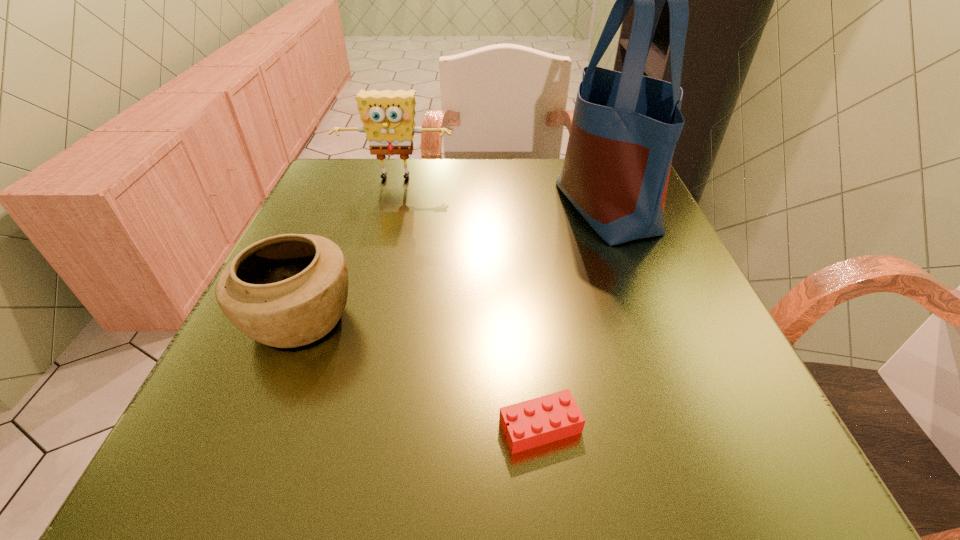
In order to click on vacant space at the near edge of the desktop in this screenshot , I will do `click(359, 470)`.

Image resolution: width=960 pixels, height=540 pixels. In the image, there is a desktop. Find the location of `vacant area at the left edge`. vacant area at the left edge is located at coordinates (351, 217).

What are the coordinates of `vacant region at the right edge of the desktop` in the screenshot? It's located at (675, 241).

In the image, there is a desktop. Identify the location of vacant space at the far left corner. coord(304,209).

You are a GUI agent. You are given a task and a screenshot of the screen. Output one action in this format:
    pyautogui.click(x=<x>, y=<y>)
    Task: Click on the free spot at the near left corner of the desktop
    The image size is (960, 540).
    Given the screenshot: What is the action you would take?
    pyautogui.click(x=230, y=456)

Where is `free space between the shortest object and the handbag`? Image resolution: width=960 pixels, height=540 pixels. free space between the shortest object and the handbag is located at coordinates (573, 317).

Where is `vacant space that's between the sponge and the third farthest object`? This screenshot has width=960, height=540. vacant space that's between the sponge and the third farthest object is located at coordinates (348, 249).

In order to click on vacant area that lies between the Lego and the second nearest object in this screenshot , I will do `click(420, 373)`.

The width and height of the screenshot is (960, 540). I want to click on free point between the handbag and the Lego, so click(x=573, y=317).

Where is `free area in between the second nearest object and the handbag`? free area in between the second nearest object and the handbag is located at coordinates (453, 263).